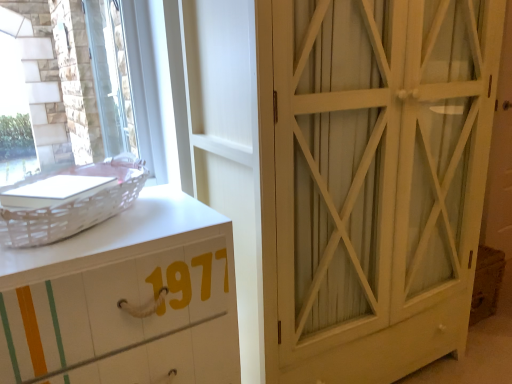
Question: From a real-world perspective, is clear glass window at upper left located higher than white wicker basket at left?

Choices:
 (A) no
 (B) yes

Answer: (B)

Question: Considering the relative sizes of clear glass window at upper left and white wicker basket at left in the image provided, is clear glass window at upper left wider than white wicker basket at left?

Choices:
 (A) yes
 (B) no

Answer: (B)

Question: Can you confirm if clear glass window at upper left is positioned to the right of white wicker basket at left?

Choices:
 (A) yes
 (B) no

Answer: (B)

Question: Does clear glass window at upper left have a lesser height compared to white wicker basket at left?

Choices:
 (A) no
 (B) yes

Answer: (A)

Question: Could you tell me if clear glass window at upper left is facing white wicker basket at left?

Choices:
 (A) no
 (B) yes

Answer: (B)

Question: Considering the positions of white painted wood chest of drawers at left and white wood cabinet at right in the image, is white painted wood chest of drawers at left taller or shorter than white wood cabinet at right?

Choices:
 (A) tall
 (B) short

Answer: (B)

Question: Based on their positions, is white painted wood chest of drawers at left located to the left or right of white wood cabinet at right?

Choices:
 (A) right
 (B) left

Answer: (B)

Question: From the image's perspective, relative to white wood cabinet at right, is white painted wood chest of drawers at left above or below?

Choices:
 (A) below
 (B) above

Answer: (A)

Question: In terms of width, does white painted wood chest of drawers at left look wider or thinner when compared to white wood cabinet at right?

Choices:
 (A) wide
 (B) thin

Answer: (B)

Question: Choose the correct answer: Is white wicker basket at left inside white painted wood chest of drawers at left or outside it?

Choices:
 (A) inside
 (B) outside

Answer: (B)

Question: Looking at their shapes, would you say white wicker basket at left is wider or thinner than white painted wood chest of drawers at left?

Choices:
 (A) wide
 (B) thin

Answer: (B)

Question: In the image, is white wicker basket at left positioned in front of or behind white painted wood chest of drawers at left?

Choices:
 (A) behind
 (B) front

Answer: (A)

Question: From a real-world perspective, is white wicker basket at left above or below white painted wood chest of drawers at left?

Choices:
 (A) below
 (B) above

Answer: (B)

Question: Looking at the image, does white wood cabinet at right seem bigger or smaller compared to white painted wood chest of drawers at left?

Choices:
 (A) small
 (B) big

Answer: (B)

Question: Choose the correct answer: Is white wood cabinet at right inside white painted wood chest of drawers at left or outside it?

Choices:
 (A) outside
 (B) inside

Answer: (A)